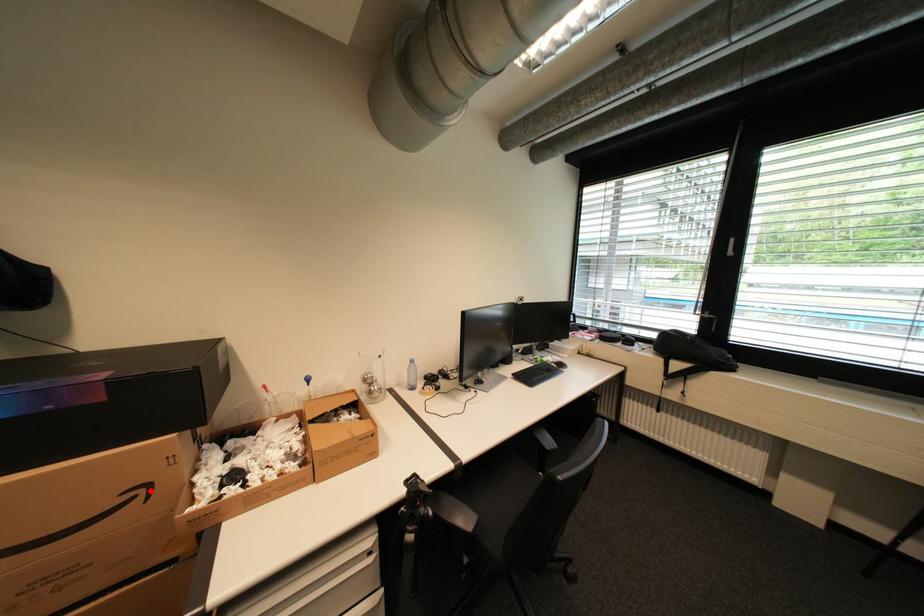
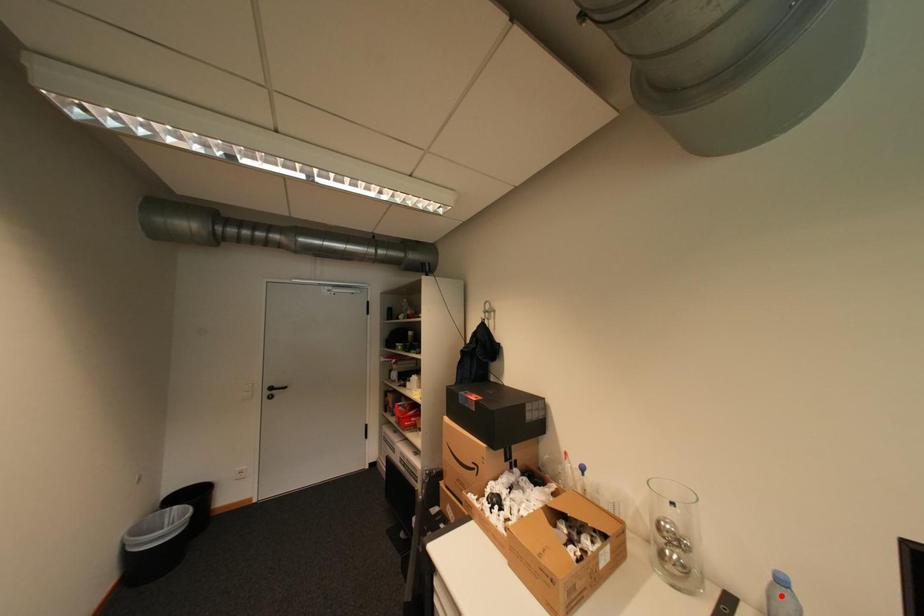
I am providing you with two images of the same scene from different viewpoints. A red point is marked on the first image and another point is marked on the second image. Are the points marked in image1 and image2 representing the same 3D position?

No